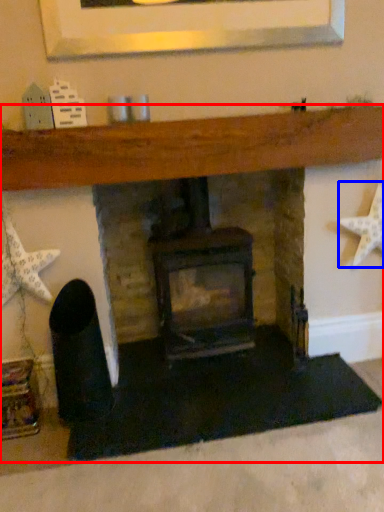
Question: Which object is further to the camera taking this photo, fireplace (highlighted by a red box) or starfish (highlighted by a blue box)?

Choices:
 (A) fireplace
 (B) starfish

Answer: (B)